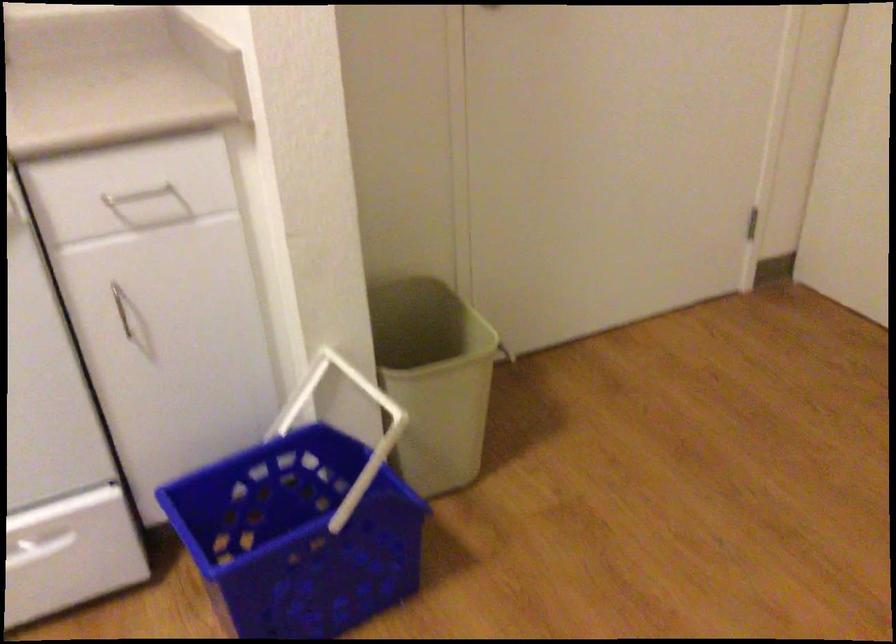
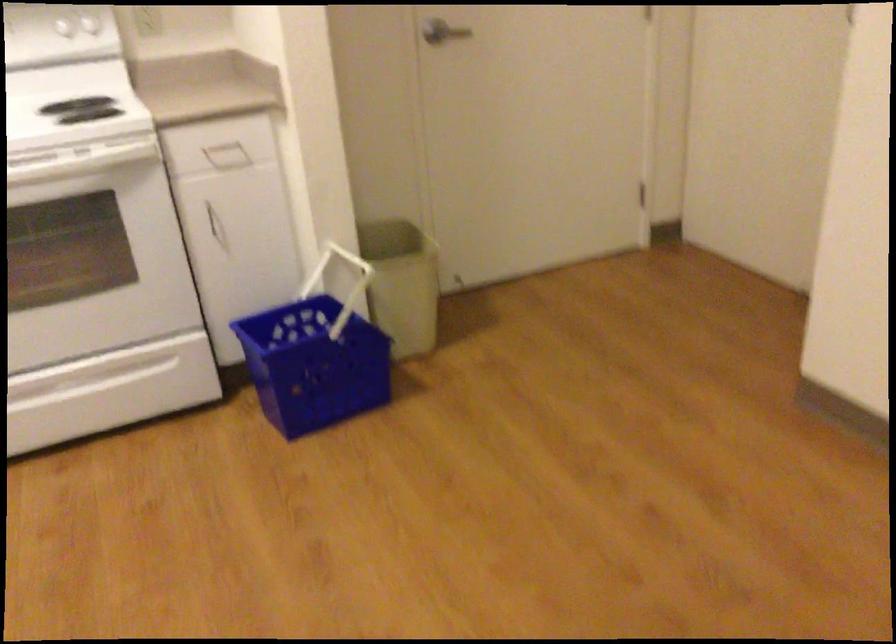
Question: What movement of the cameraman would produce the second image?

Choices:
 (A) Left
 (B) Right
 (C) Forward
 (D) Backward

Answer: (D)